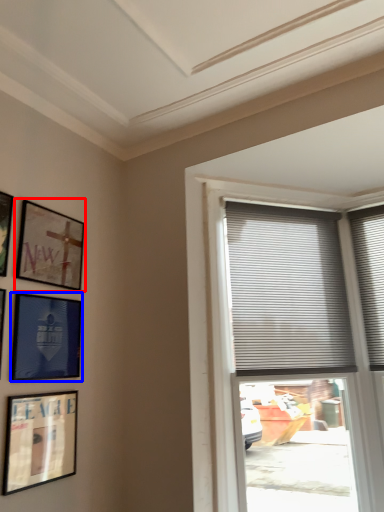
Question: Among these objects, which one is nearest to the camera, picture frame (highlighted by a red box) or picture frame (highlighted by a blue box)?

Choices:
 (A) picture frame
 (B) picture frame

Answer: (B)